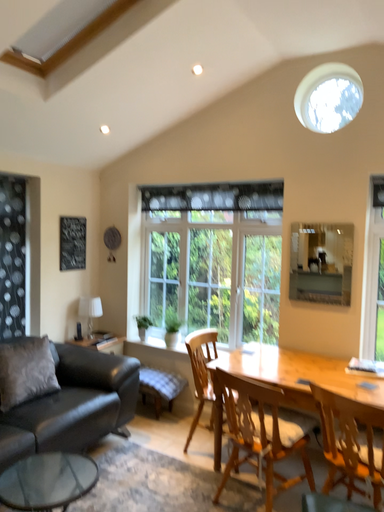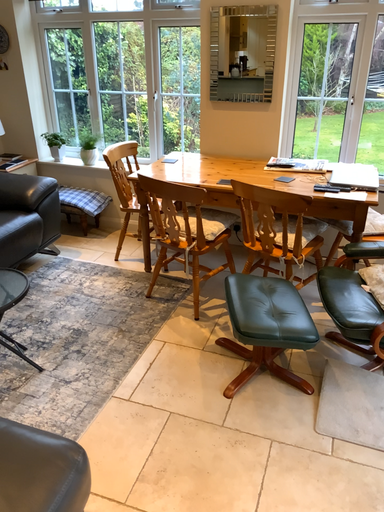
Question: Which way did the camera rotate in the video?

Choices:
 (A) rotated right
 (B) rotated left

Answer: (A)